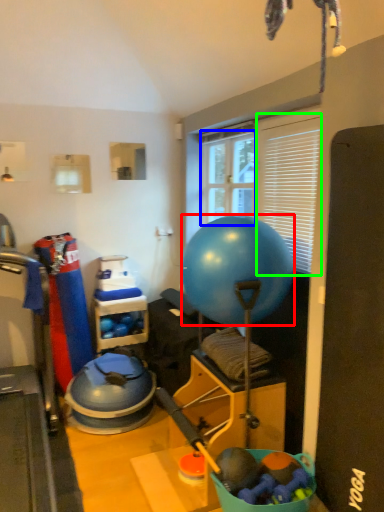
Question: Which object is the farthest from ball (highlighted by a red box)? Choose among these: window screen (highlighted by a blue box) or window screen (highlighted by a green box).

Choices:
 (A) window screen
 (B) window screen

Answer: (A)